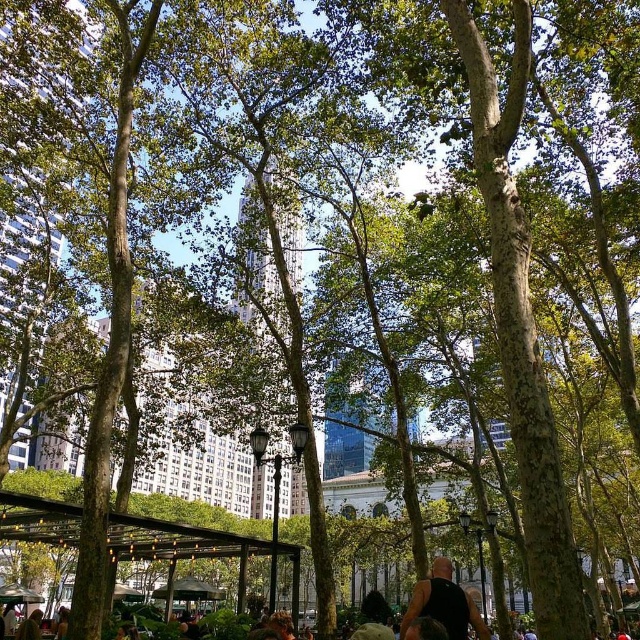
Question: From the image, what is the correct spatial relationship of brown wooden canopy at center in relation to metallic silver canopy at lower left?

Choices:
 (A) right
 (B) left

Answer: (A)

Question: Considering the real-world distances, which object is farthest from the brown wooden canopy at center?

Choices:
 (A) metallic silver canopy at lower left
 (B) black sleeveless shirt at center

Answer: (B)

Question: Does black sleeveless shirt at center have a greater width compared to brown wooden canopy at center?

Choices:
 (A) yes
 (B) no

Answer: (B)

Question: Which object is farther from the camera taking this photo?

Choices:
 (A) metallic silver canopy at lower left
 (B) brown wooden canopy at center
 (C) black sleeveless shirt at center

Answer: (A)

Question: Which object is the closest to the brown wooden canopy at center?

Choices:
 (A) metallic silver canopy at lower left
 (B) black sleeveless shirt at center

Answer: (A)

Question: Is black sleeveless shirt at center to the right of metallic silver canopy at lower left from the viewer's perspective?

Choices:
 (A) no
 (B) yes

Answer: (B)